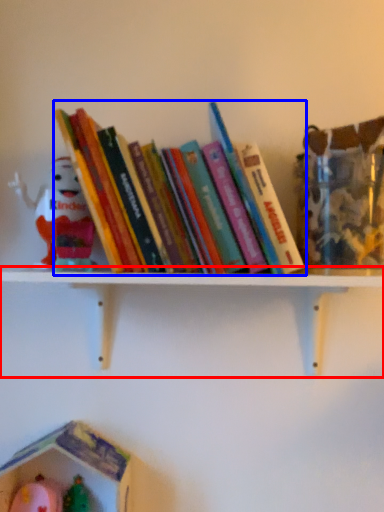
Question: Which of the following is the closest to the observer, shelf (highlighted by a red box) or book (highlighted by a blue box)?

Choices:
 (A) shelf
 (B) book

Answer: (B)